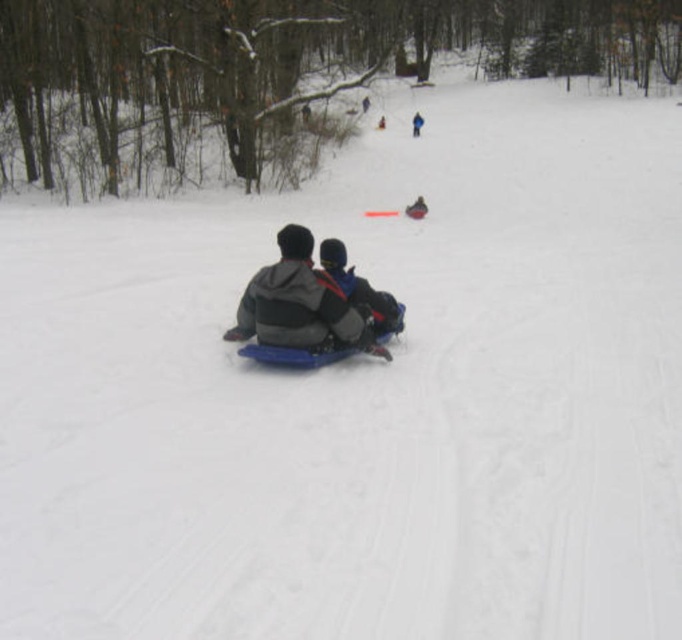
Does point (336, 316) come farther from viewer compared to point (381, 296)?

No, it is not.

Can you confirm if blue plastic sled at center is positioned above dark blue fabric jacket at center?

Actually, blue plastic sled at center is below dark blue fabric jacket at center.

Where is `blue plastic sled at center`? The image size is (682, 640). blue plastic sled at center is located at coordinates (301, 305).

Between blue plastic sled at center and dark gray fleece jacket at center, which one has more height?

With more height is blue plastic sled at center.

Can you confirm if blue plastic sled at center is positioned above dark gray fleece jacket at center?

Actually, blue plastic sled at center is below dark gray fleece jacket at center.

Where is `blue plastic sled at center`? The image size is (682, 640). blue plastic sled at center is located at coordinates (301, 305).

Does point (295, 275) come in front of point (421, 118)?

Yes, point (295, 275) is in front of point (421, 118).

Describe the element at coordinates (301, 305) in the screenshot. I see `blue plastic sled at center` at that location.

This screenshot has width=682, height=640. I want to click on blue plastic sled at center, so click(301, 305).